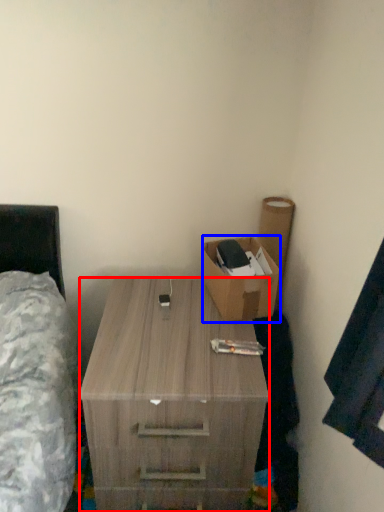
Question: Which of the following is the farthest to the observer, desk (highlighted by a red box) or box (highlighted by a blue box)?

Choices:
 (A) desk
 (B) box

Answer: (B)